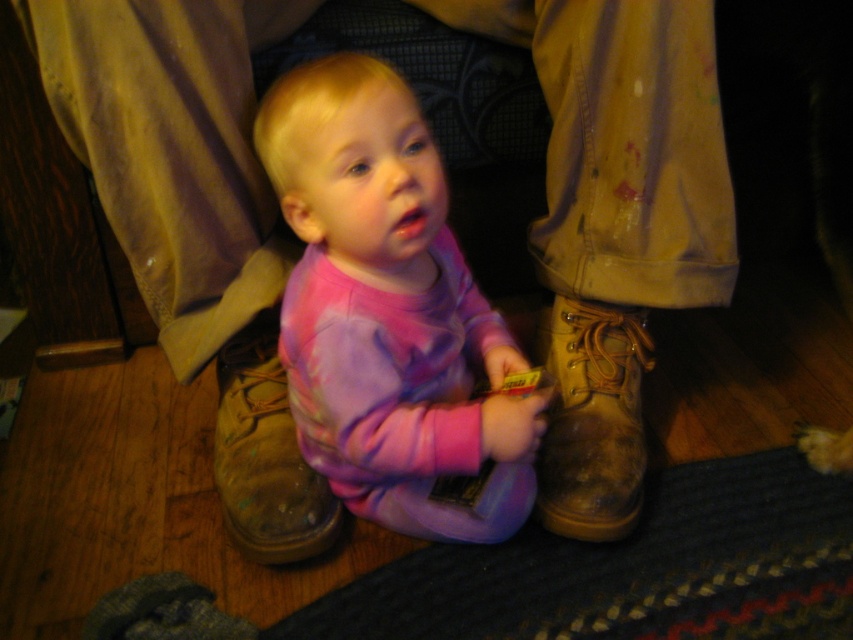
Question: Which point is closer to the camera?

Choices:
 (A) (286, 461)
 (B) (404, 529)
 (C) (560, 477)

Answer: (C)

Question: Which point is farther to the camera?

Choices:
 (A) (231, 444)
 (B) (376, 470)
 (C) (628, 426)

Answer: (C)

Question: Can you confirm if leather boot at lower center is positioned to the right of brown leather boot at lower center?

Choices:
 (A) no
 (B) yes

Answer: (B)

Question: Is leather boot at lower center thinner than brown leather boot at lower center?

Choices:
 (A) yes
 (B) no

Answer: (A)

Question: Can you confirm if pink tie-dye shirt at center is thinner than leather boot at lower center?

Choices:
 (A) yes
 (B) no

Answer: (B)

Question: Which point appears closest to the camera in this image?

Choices:
 (A) (595, 317)
 (B) (239, 381)

Answer: (B)